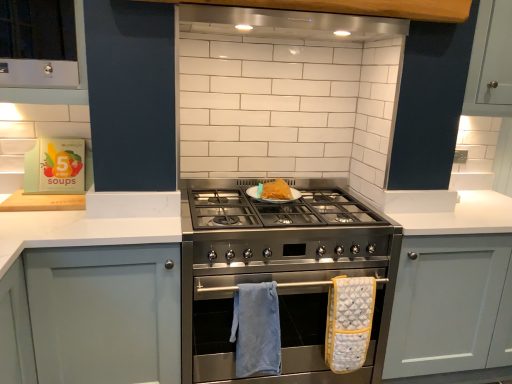
Question: Considering the relative positions of stainless steel stove at center and yellow quilted oven mitt at center, marked as the 1th bath towel in a right-to-left arrangement, in the image provided, is stainless steel stove at center to the right of yellow quilted oven mitt at center, marked as the 1th bath towel in a right-to-left arrangement, from the viewer's perspective?

Choices:
 (A) yes
 (B) no

Answer: (B)

Question: From the image's perspective, is stainless steel stove at center located above yellow quilted oven mitt at center, marked as the 1th bath towel in a right-to-left arrangement?

Choices:
 (A) yes
 (B) no

Answer: (A)

Question: From a real-world perspective, is stainless steel stove at center under yellow quilted oven mitt at center, marked as the 1th bath towel in a right-to-left arrangement?

Choices:
 (A) no
 (B) yes

Answer: (A)

Question: Does stainless steel stove at center turn towards yellow quilted oven mitt at center, marked as the 1th bath towel in a right-to-left arrangement?

Choices:
 (A) no
 (B) yes

Answer: (B)

Question: Can you confirm if stainless steel stove at center is smaller than yellow quilted oven mitt at center, marked as the 1th bath towel in a right-to-left arrangement?

Choices:
 (A) yes
 (B) no

Answer: (B)

Question: Is stainless steel stove at center completely or partially outside of yellow quilted oven mitt at center, marked as the 1th bath towel in a right-to-left arrangement?

Choices:
 (A) yes
 (B) no

Answer: (A)

Question: Considering the relative positions of blue soft towel at lower center, which is the second bath towel from right to left, and stainless steel exhaust hood at upper center in the image provided, is blue soft towel at lower center, which is the second bath towel from right to left, behind stainless steel exhaust hood at upper center?

Choices:
 (A) no
 (B) yes

Answer: (B)

Question: Would you say blue soft towel at lower center, the first bath towel from the left, contains stainless steel exhaust hood at upper center?

Choices:
 (A) no
 (B) yes

Answer: (A)

Question: Can we say blue soft towel at lower center, which is the second bath towel from right to left, lies outside stainless steel exhaust hood at upper center?

Choices:
 (A) no
 (B) yes

Answer: (B)

Question: Can you confirm if blue soft towel at lower center, the first bath towel from the left, is positioned to the left of stainless steel exhaust hood at upper center?

Choices:
 (A) yes
 (B) no

Answer: (A)

Question: From a real-world perspective, is blue soft towel at lower center, which is the second bath towel from right to left, positioned over stainless steel exhaust hood at upper center based on gravity?

Choices:
 (A) no
 (B) yes

Answer: (A)

Question: Is blue soft towel at lower center, which is the second bath towel from right to left, wider than stainless steel exhaust hood at upper center?

Choices:
 (A) no
 (B) yes

Answer: (A)

Question: From the image's perspective, is white matte cabinet at left, which is the second cabinetry in right-to-left order, located above matte gray cabinet at center, which is counted as the 1th cabinetry, starting from the right?

Choices:
 (A) no
 (B) yes

Answer: (A)